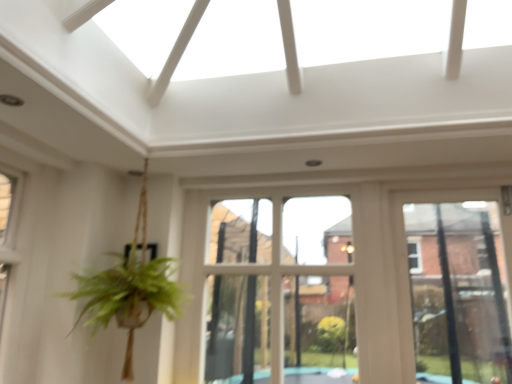
Question: In terms of width, does white wood bay window at center look wider or thinner when compared to clear glass window at center?

Choices:
 (A) thin
 (B) wide

Answer: (B)

Question: From a real-world perspective, is white wood bay window at center positioned above or below clear glass window at center?

Choices:
 (A) below
 (B) above

Answer: (B)

Question: Is white wood bay window at center inside or outside of clear glass window at center?

Choices:
 (A) outside
 (B) inside

Answer: (A)

Question: Which is correct: clear glass window at center is inside white wood bay window at center, or outside of it?

Choices:
 (A) inside
 (B) outside

Answer: (B)

Question: Visually, is clear glass window at center positioned to the left or to the right of white wood bay window at center?

Choices:
 (A) left
 (B) right

Answer: (B)

Question: From the image's perspective, is clear glass window at center above or below white wood bay window at center?

Choices:
 (A) below
 (B) above

Answer: (A)

Question: Looking at their shapes, would you say clear glass window at center is wider or thinner than white wood bay window at center?

Choices:
 (A) thin
 (B) wide

Answer: (A)